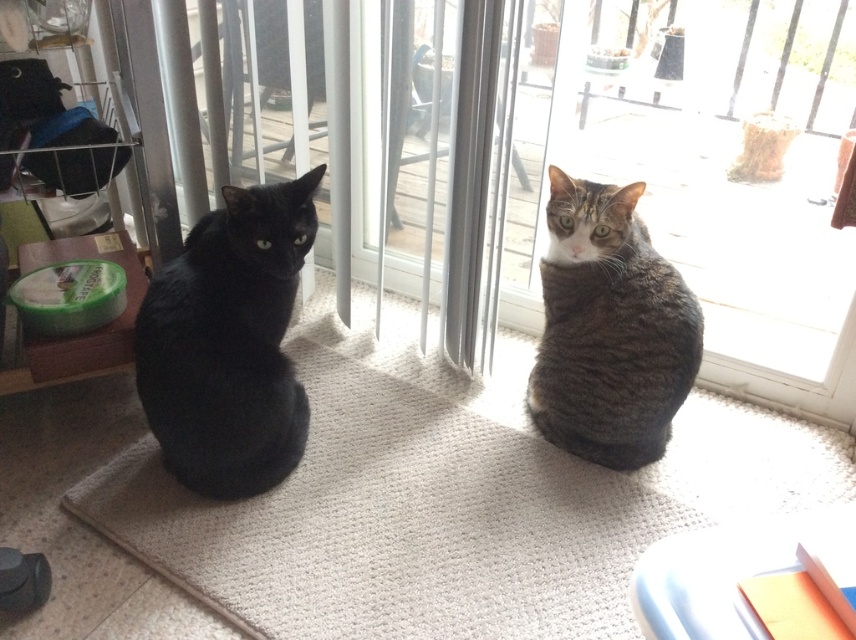
You are a cat owner who wants to let your cats outside through the sliding glass door. You notice the matte black cat at left and the tabby fur cat at center. Which cat is closer to the sliding glass door?

The matte black cat at left is closer to the sliding glass door because it is in front of the tabby fur cat at center.

You are a cat owner who wants to place a cat tree in the room. The cat tree requires 2 meters of vertical space. Given the height of the matte black cat at left and the tabby fur cat at center, will the cat tree fit in the room?

The matte black cat at left is taller than the tabby fur cat at center, but the description does not provide specific height measurements for either cat. Therefore, it is impossible to determine if the cat tree requiring 2 meters of vertical space will fit in the room based on the given information.

You are a cat owner who wants to place a new cat tree in the room where the matte black cat at left and the tabby fur cat at center are sitting. The cat tree must be placed between them. Based on their current positions, where should you position the cat tree?

The matte black cat at left is located below the tabby fur cat at center, so the cat tree should be placed between them by positioning it above the matte black cat at left and below the tabby fur cat at center to ensure it is between both cats.